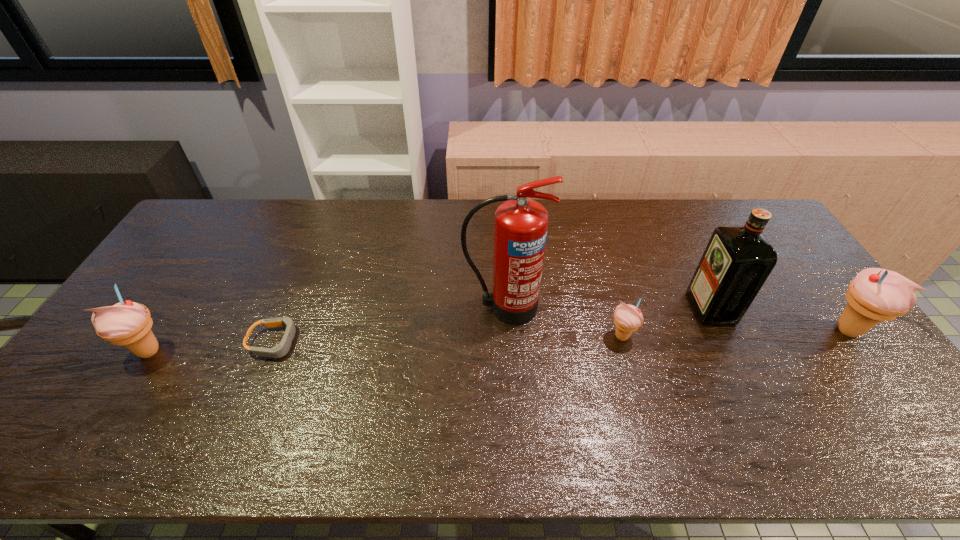
If equal spacing is the goal by inserting an additional icecream among them, please point out a vacant space for this new icecream. Please provide its 2D coordinates. Your answer should be formatted as a tuple, i.e. [(x, y)], where the tuple contains the x and y coordinates of a point satisfying the conditions above.

[(389, 344)]